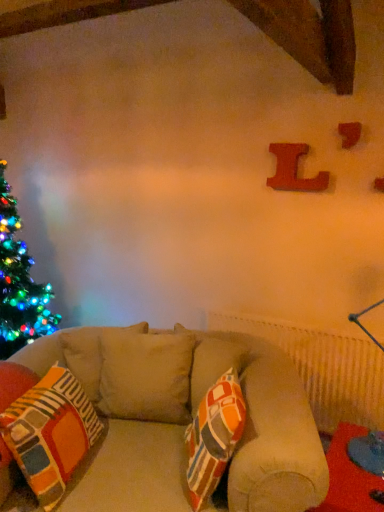
Locate an element on the screen. The width and height of the screenshot is (384, 512). multicolored fabric pillow at center is located at coordinates (50, 433).

Locate an element on the screen. The width and height of the screenshot is (384, 512). multicolored fabric pillow at center is located at coordinates (50, 433).

Who is shorter, wooden letter at upper right, the 1th alphabet from the right, or multicolored fabric pillow at center?

With less height is wooden letter at upper right, the 1th alphabet from the right.

Which of these two, wooden letter at upper right, the 1th alphabet when ordered from front to back, or multicolored fabric pillow at center, is thinner?

wooden letter at upper right, the 1th alphabet when ordered from front to back, is thinner.

From a real-world perspective, who is located lower, red fabric table at lower right or multicolored fabric pillow at center?

In real-world perspective, red fabric table at lower right is lower.

From the image's perspective, does red fabric table at lower right appear higher than multicolored fabric pillow at center?

Incorrect, from the image's perspective, red fabric table at lower right is lower than multicolored fabric pillow at center.

Who is more distant, red fabric table at lower right or multicolored fabric pillow at center?

Positioned behind is red fabric table at lower right.

Is red fabric table at lower right in contact with multicolored fabric pillow at center?

No, red fabric table at lower right is not making contact with multicolored fabric pillow at center.

Consider the image. Is multicolored fabric pillow at center to the right of red fabric table at lower right from the viewer's perspective?

No.

How many degrees apart are the facing directions of multicolored fabric pillow at center and red fabric table at lower right?

There is a 69.6-degree angle between the facing directions of multicolored fabric pillow at center and red fabric table at lower right.

Is multicolored fabric pillow at center next to red fabric table at lower right and touching it?

They are not placed beside each other.

From a real-world perspective, which object stands above the other?

multicolored fabric pillow at center is physically above.

From the multicolored fabric pillow at center, count 2nd alphabets backward and point to it. Please provide its 2D coordinates.

[(294, 170)]

Relative to wooden letter l at upper right, the first alphabet viewed from the back, is multicolored fabric pillow at center in front or behind?

In the image, multicolored fabric pillow at center appears in front of wooden letter l at upper right, the first alphabet viewed from the back.

Between multicolored fabric pillow at center and wooden letter l at upper right, the first alphabet viewed from the back, which one has smaller size?

wooden letter l at upper right, the first alphabet viewed from the back.

Can you tell me how much multicolored fabric pillow at center and wooden letter l at upper right, the first alphabet viewed from the back, differ in facing direction?

69.6 degrees.

Consider the image. Is red fabric table at lower right far from multicolored fabric pillow at center?

They are positioned close to each other.

From a real-world perspective, between red fabric table at lower right and multicolored fabric pillow at center, who is vertically lower?

red fabric table at lower right.

Is the depth of red fabric table at lower right less than that of multicolored fabric pillow at center?

No, the depth of red fabric table at lower right is greater than that of multicolored fabric pillow at center.

Which point is more forward, (x=371, y=475) or (x=223, y=384)?

The point (x=371, y=475) is closer.

Which point is more forward, (x=101, y=422) or (x=325, y=511)?

The point (x=325, y=511) is in front.

At what (x,y) coordinates should I click in order to perform the action: click on pillow above the red fabric table at lower right (from a real-world perspective). Please return your answer as a coordinate pair (x, y). This screenshot has height=512, width=384. Looking at the image, I should click on (50, 433).

From the picture: Is multicolored fabric pillow at center facing towards red fabric table at lower right?

Yes, multicolored fabric pillow at center is turned towards red fabric table at lower right.

Between multicolored fabric pillow at center and red fabric table at lower right, which one has less height?

With less height is red fabric table at lower right.

How much distance is there between red fabric table at lower right and wooden letter l at upper right, which appears as the second alphabet when viewed from the right?

The distance of red fabric table at lower right from wooden letter l at upper right, which appears as the second alphabet when viewed from the right, is 1.28 meters.

Find the location of a particular element. The width and height of the screenshot is (384, 512). table in front of the wooden letter l at upper right, which appears as the second alphabet when viewed from the right is located at coordinates (348, 476).

In the scene shown: From the image's perspective, which one is positioned lower, red fabric table at lower right or wooden letter l at upper right, the first alphabet viewed from the left?

red fabric table at lower right is shown below in the image.

Which object is further away from the camera, red fabric table at lower right or wooden letter l at upper right, the first alphabet viewed from the back?

wooden letter l at upper right, the first alphabet viewed from the back, is behind.

The width and height of the screenshot is (384, 512). What are the coordinates of `throw pillow located below the wooden letter at upper right, the 1th alphabet from the right (from the image's perspective)` in the screenshot? It's located at (214, 437).

Image resolution: width=384 pixels, height=512 pixels. Find the location of `pillow in front of the red fabric table at lower right`. pillow in front of the red fabric table at lower right is located at coordinates (50, 433).

Looking at the image, which one is located further to wooden letter at upper right, which is the 2th alphabet from left to right, multicolored fabric pillow at center or multicolored fabric pillow at center?

multicolored fabric pillow at center is further to wooden letter at upper right, which is the 2th alphabet from left to right.

Looking at the image, which one is located closer to multicolored fabric pillow at center, wooden letter at upper right, the 1th alphabet from the right, or wooden letter l at upper right, the first alphabet viewed from the left?

wooden letter l at upper right, the first alphabet viewed from the left, lies closer to multicolored fabric pillow at center than the other object.

Consider the image. Estimate the real-world distances between objects in this image. Which object is closer to wooden letter l at upper right, the 2th alphabet positioned from the front, multicolored fabric pillow at center or red fabric table at lower right?

multicolored fabric pillow at center lies closer to wooden letter l at upper right, the 2th alphabet positioned from the front, than the other object.

From the image, which object appears to be farther from multicolored fabric pillow at center, red fabric table at lower right or multicolored fabric pillow at center?

The object further to multicolored fabric pillow at center is red fabric table at lower right.

Which object lies further to the anchor point wooden letter l at upper right, the 2th alphabet positioned from the front, red fabric table at lower right or multicolored fabric pillow at center?

Based on the image, multicolored fabric pillow at center appears to be further to wooden letter l at upper right, the 2th alphabet positioned from the front.

Based on their spatial positions, is multicolored fabric pillow at center or red fabric table at lower right closer to multicolored fabric pillow at center?

Among the two, red fabric table at lower right is located nearer to multicolored fabric pillow at center.

Looking at the image, which one is located closer to multicolored fabric pillow at center, red fabric table at lower right or wooden letter l at upper right, which appears as the second alphabet when viewed from the right?

red fabric table at lower right is positioned closer to the anchor multicolored fabric pillow at center.

Estimate the real-world distances between objects in this image. Which object is further from multicolored fabric pillow at center, wooden letter l at upper right, which appears as the second alphabet when viewed from the right, or wooden letter at upper right, the 1th alphabet when ordered from front to back?

wooden letter at upper right, the 1th alphabet when ordered from front to back, is further to multicolored fabric pillow at center.

Where is `throw pillow between wooden letter l at upper right, the first alphabet viewed from the back, and multicolored fabric pillow at center vertically`? throw pillow between wooden letter l at upper right, the first alphabet viewed from the back, and multicolored fabric pillow at center vertically is located at coordinates (214, 437).

At what (x,y) coordinates should I click in order to perform the action: click on pillow between wooden letter at upper right, which is the 2th alphabet from left to right, and red fabric table at lower right, in the vertical direction. Please return your answer as a coordinate pair (x, y). The image size is (384, 512). Looking at the image, I should click on (50, 433).

You are a GUI agent. You are given a task and a screenshot of the screen. Output one action in this format:
    pyautogui.click(x=<x>, y=<y>)
    Task: Click on the alphabet between multicolored fabric pillow at center and wooden letter at upper right, the 1th alphabet from the right, from left to right
    
    Given the screenshot: What is the action you would take?
    pyautogui.click(x=294, y=170)

This screenshot has width=384, height=512. What are the coordinates of `pillow between wooden letter l at upper right, which appears as the second alphabet when viewed from the right, and red fabric table at lower right in the up-down direction` in the screenshot? It's located at (50, 433).